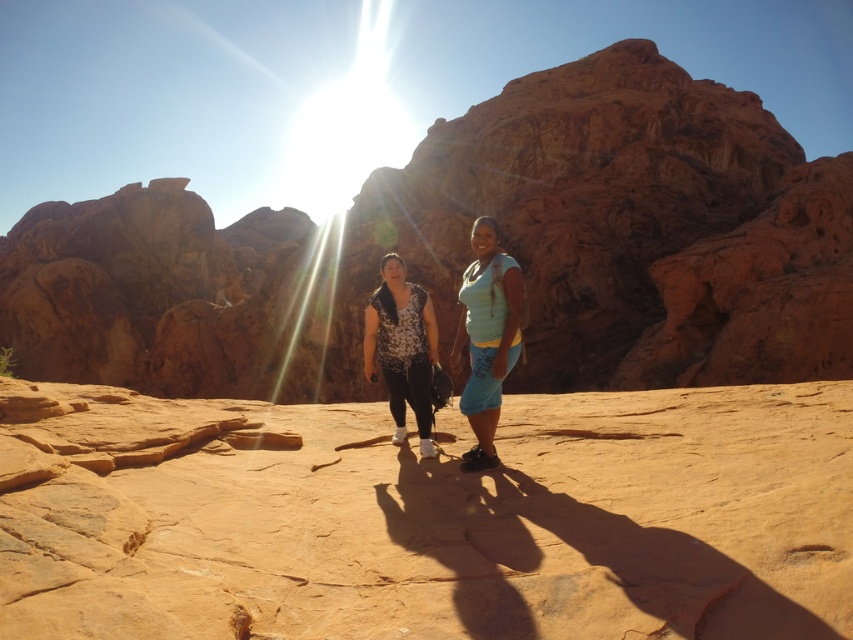
Question: Which of these objects is positioned farthest from the rustic sandstone rock formation at center?

Choices:
 (A) matte teal shirt at center
 (B) printed fabric blouse at center
 (C) smooth sandstone desert at center
 (D) matte floral shirt at center

Answer: (B)

Question: Is matte floral shirt at center bigger than matte teal shirt at center?

Choices:
 (A) no
 (B) yes

Answer: (B)

Question: From the image, what is the correct spatial relationship of smooth sandstone desert at center in relation to matte floral shirt at center?

Choices:
 (A) above
 (B) below

Answer: (B)

Question: Can you confirm if rustic sandstone rock formation at center is wider than printed fabric blouse at center?

Choices:
 (A) no
 (B) yes

Answer: (B)

Question: Which point appears closest to the camera in this image?

Choices:
 (A) (489, 376)
 (B) (479, 394)
 (C) (480, 634)

Answer: (C)

Question: Which of the following is the closest to the observer?

Choices:
 (A) (393, 369)
 (B) (477, 353)
 (C) (285, 220)

Answer: (B)